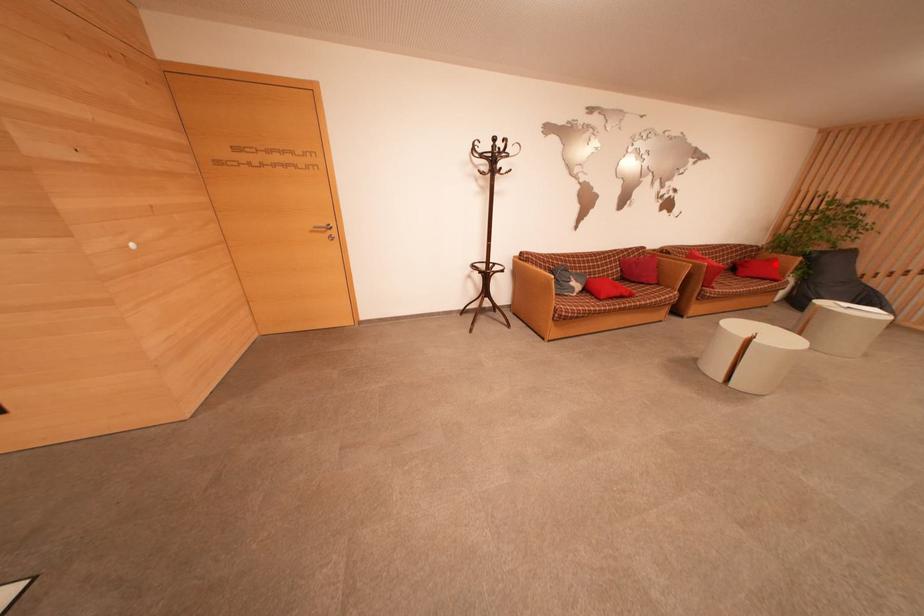
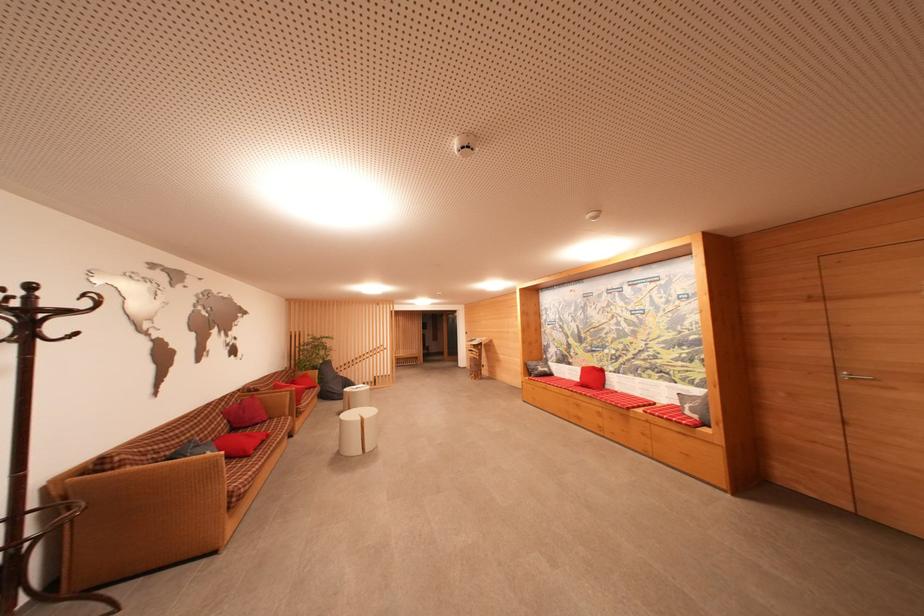
Locate, in the second image, the point that corresponds to the highlighted location in the first image.

(310, 379)